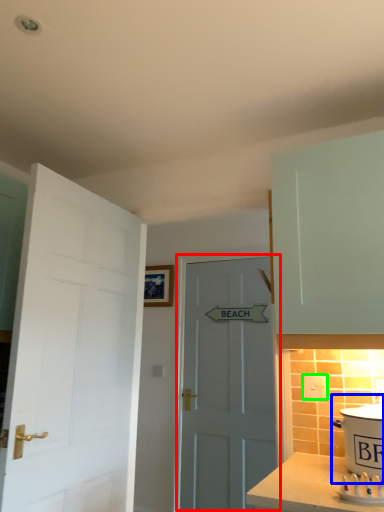
Question: Based on their relative distances, which object is farther from door (highlighted by a red box)? Choose from cooker (highlighted by a blue box) and electric outlet (highlighted by a green box).

Choices:
 (A) cooker
 (B) electric outlet

Answer: (A)